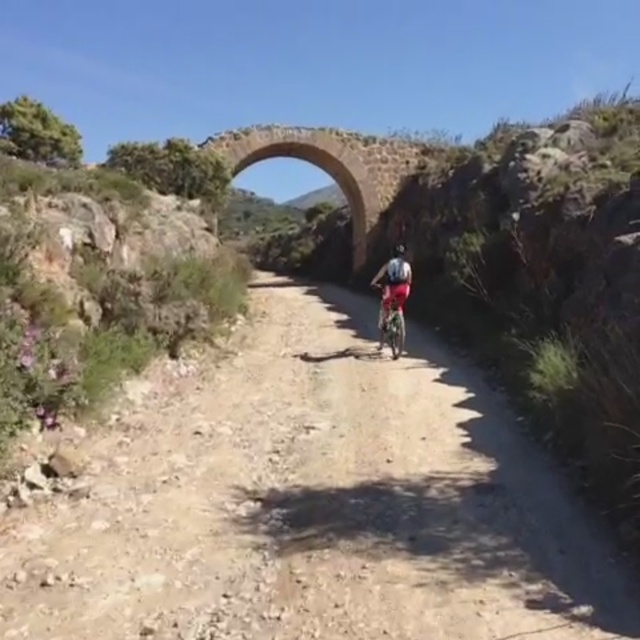
Question: Does stone archway at center come in front of matte black helmet at center?

Choices:
 (A) no
 (B) yes

Answer: (A)

Question: Does dirt path at center have a greater width compared to red fabric cyclist at center?

Choices:
 (A) yes
 (B) no

Answer: (A)

Question: Which of the following is the farthest from the observer?

Choices:
 (A) shiny metallic bicycle at center
 (B) red fabric cyclist at center
 (C) dirt path at center
 (D) matte black helmet at center

Answer: (D)

Question: Which point is farther from the camera taking this photo?

Choices:
 (A) (312, 138)
 (B) (406, 280)
 (C) (90, 461)
 (D) (392, 348)

Answer: (A)

Question: Which object appears farthest from the camera in this image?

Choices:
 (A) shiny metallic bicycle at center
 (B) stone archway at center
 (C) dirt path at center
 (D) matte black helmet at center

Answer: (B)

Question: Is stone archway at center in front of shiny metallic bicycle at center?

Choices:
 (A) no
 (B) yes

Answer: (A)